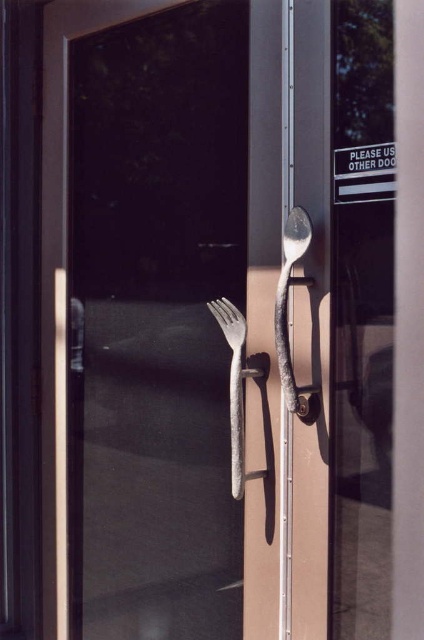
From the picture: Can you confirm if shiny silver spoon at center is bigger than rusty metal fork at center?

No, shiny silver spoon at center is not bigger than rusty metal fork at center.

Consider the image. Who is lower down, shiny silver spoon at center or rusty metal fork at center?

rusty metal fork at center

Locate an element on the screen. The height and width of the screenshot is (640, 424). shiny silver spoon at center is located at coordinates (287, 320).

Identify the location of shiny silver spoon at center. tap(287, 320).